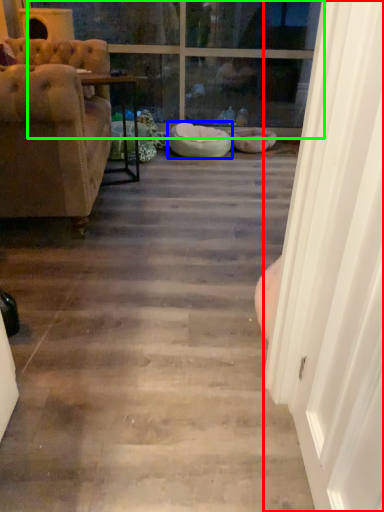
Question: Which is nearer to the screen door (highlighted by a red box)? dog bed (highlighted by a blue box) or window (highlighted by a green box).

Choices:
 (A) dog bed
 (B) window

Answer: (A)